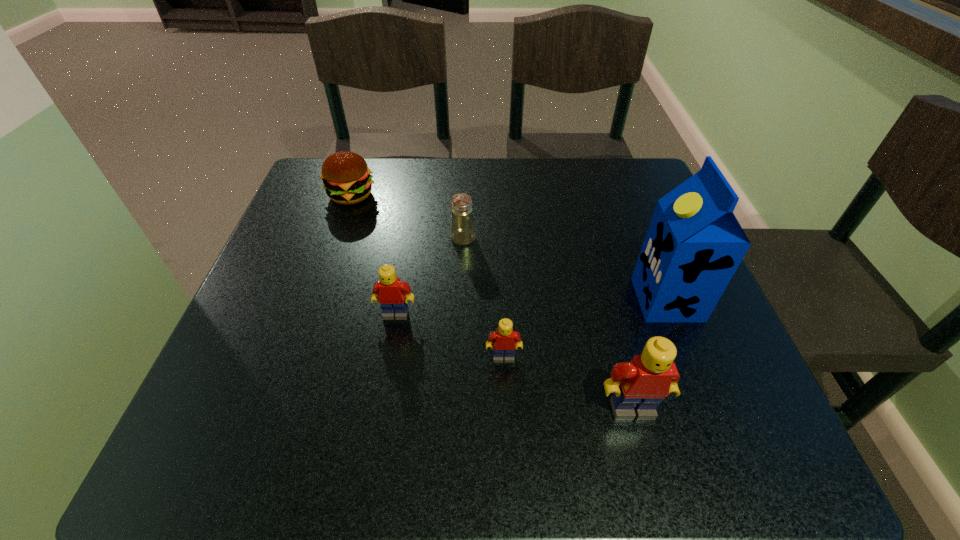
Image resolution: width=960 pixels, height=540 pixels. I want to click on free space for a new Lego on the left, so click(x=304, y=278).